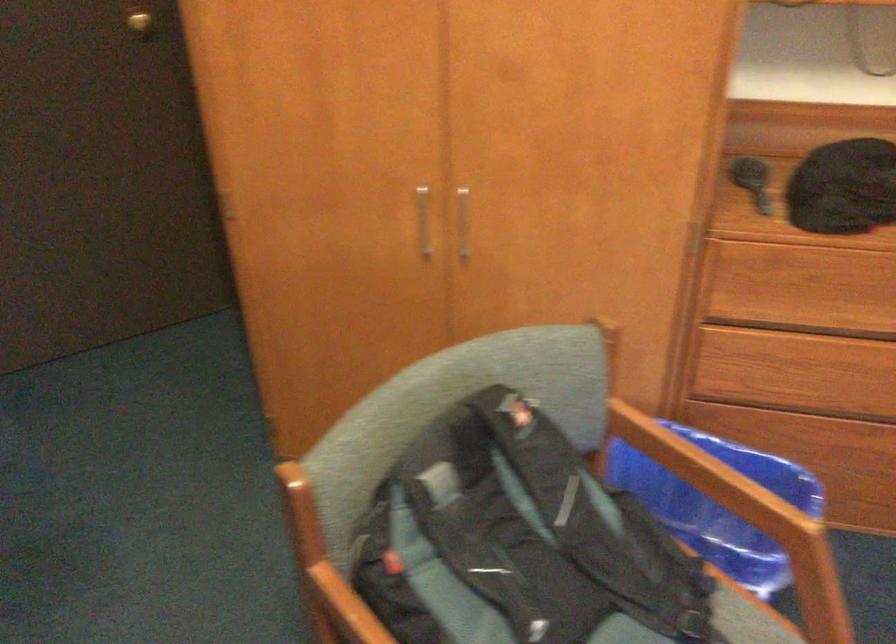
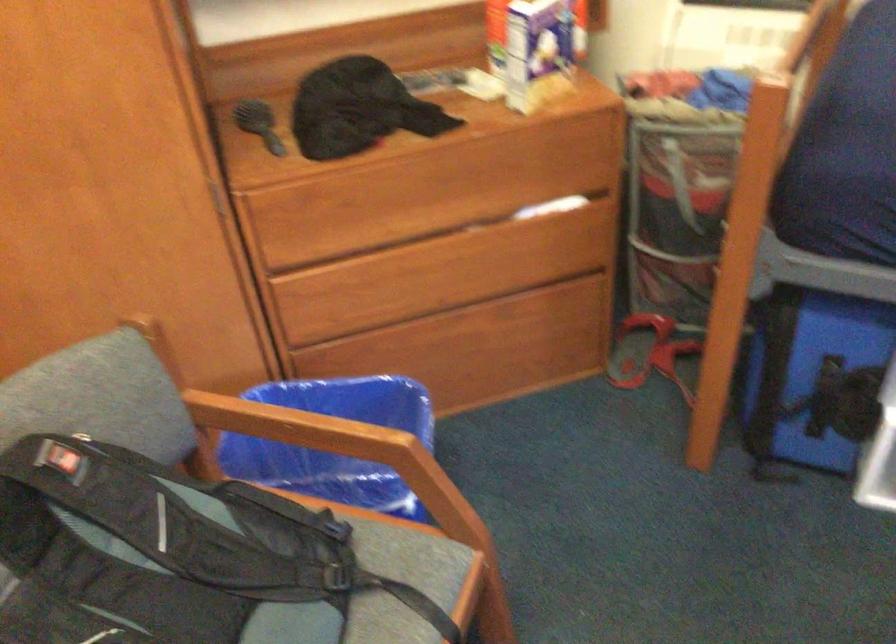
Where in the second image is the point corresponding to point 734,504 from the first image?

(334, 440)